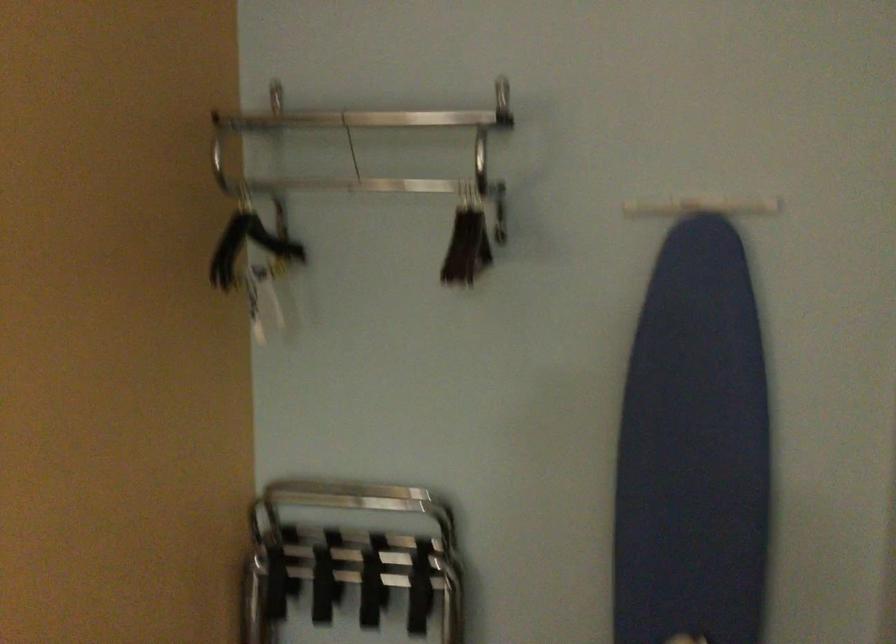
Where is `black clothes hanger`? black clothes hanger is located at coordinates (350, 562).